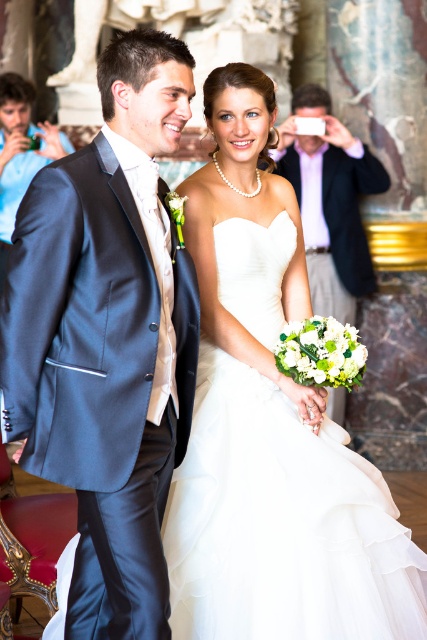
Find the location of `white tulle dress at center`. white tulle dress at center is located at coordinates (281, 524).

In the scene shown: Does white tulle dress at center have a lesser width compared to satin blue suit at left?

No.

Is point (366, 579) in front of point (6, 145)?

Yes.

The width and height of the screenshot is (427, 640). What are the coordinates of `white tulle dress at center` in the screenshot? It's located at (281, 524).

Which is below, satin navy suit at left or matte white shirt at upper center?

Positioned lower is satin navy suit at left.

Does point (35, 342) come farther from viewer compared to point (328, 116)?

No, (35, 342) is closer to viewer.

Which is in front, point (91, 563) or point (321, 138)?

Point (91, 563)

This screenshot has width=427, height=640. Find the location of `satin navy suit at left`. satin navy suit at left is located at coordinates (108, 337).

Does point (76, 392) come in front of point (20, 80)?

Yes.

Is satin navy suit at left positioned before satin blue suit at left?

Yes.

Locate an element on the screen. This screenshot has width=427, height=640. satin navy suit at left is located at coordinates (108, 337).

Identify the location of satin navy suit at left. (108, 337).